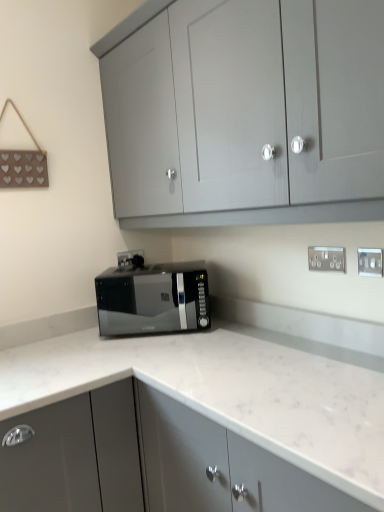
Question: Is silver metallic electric outlet at center-right, which ranks as the 3th electric outlet in right-to-left order, far away from white marble countertop at center, acting as the 2th cabinetry starting from the top?

Choices:
 (A) yes
 (B) no

Answer: (B)

Question: Considering the relative sizes of silver metallic electric outlet at center-right, which ranks as the 3th electric outlet in right-to-left order, and white marble countertop at center, the 1th cabinetry from the bottom, in the image provided, is silver metallic electric outlet at center-right, which ranks as the 3th electric outlet in right-to-left order, shorter than white marble countertop at center, the 1th cabinetry from the bottom,?

Choices:
 (A) no
 (B) yes

Answer: (B)

Question: Is white marble countertop at center, the 1th cabinetry from the bottom, located within silver metallic electric outlet at center-right, which ranks as the 3th electric outlet in right-to-left order?

Choices:
 (A) no
 (B) yes

Answer: (A)

Question: Is silver metallic electric outlet at center-right, the 1th electric outlet when ordered from back to front, positioned in front of white marble countertop at center, acting as the 2th cabinetry starting from the top?

Choices:
 (A) no
 (B) yes

Answer: (A)

Question: Could you tell me if silver metallic electric outlet at center-right, which appears as the third electric outlet when viewed from the front, is facing white marble countertop at center, acting as the 2th cabinetry starting from the top?

Choices:
 (A) no
 (B) yes

Answer: (A)

Question: Does silver metallic electric outlet at center-right, the 1th electric outlet when ordered from back to front, appear on the left side of white marble countertop at center, the 1th cabinetry from the bottom?

Choices:
 (A) yes
 (B) no

Answer: (A)

Question: Considering the relative sizes of white plastic electric outlet at upper right, the 3th electric outlet from the left, and silver metallic electric outlet at center-right, the 1th electric outlet when ordered from back to front, in the image provided, is white plastic electric outlet at upper right, the 3th electric outlet from the left, thinner than silver metallic electric outlet at center-right, the 1th electric outlet when ordered from back to front,?

Choices:
 (A) no
 (B) yes

Answer: (A)

Question: From a real-world perspective, is white plastic electric outlet at upper right, marked as the 3th electric outlet in a back-to-front arrangement, under silver metallic electric outlet at center-right, the 1th electric outlet when ordered from back to front?

Choices:
 (A) no
 (B) yes

Answer: (A)

Question: Can you confirm if white plastic electric outlet at upper right, the first electric outlet in the right-to-left sequence, is positioned to the right of silver metallic electric outlet at center-right, positioned as the first electric outlet in left-to-right order?

Choices:
 (A) no
 (B) yes

Answer: (B)

Question: From the image's perspective, does white plastic electric outlet at upper right, the 3th electric outlet from the left, appear lower than silver metallic electric outlet at center-right, positioned as the first electric outlet in left-to-right order?

Choices:
 (A) yes
 (B) no

Answer: (A)

Question: Is white plastic electric outlet at upper right, the 3th electric outlet from the left, positioned far away from silver metallic electric outlet at center-right, which appears as the third electric outlet when viewed from the front?

Choices:
 (A) no
 (B) yes

Answer: (B)

Question: Does white plastic electric outlet at upper right, the 3th electric outlet from the left, have a lesser height compared to silver metallic electric outlet at center-right, positioned as the first electric outlet in left-to-right order?

Choices:
 (A) yes
 (B) no

Answer: (B)

Question: Could you tell me if black glossy microwave at center is turned towards white marble countertop at center, the 1th cabinetry from the bottom?

Choices:
 (A) no
 (B) yes

Answer: (A)